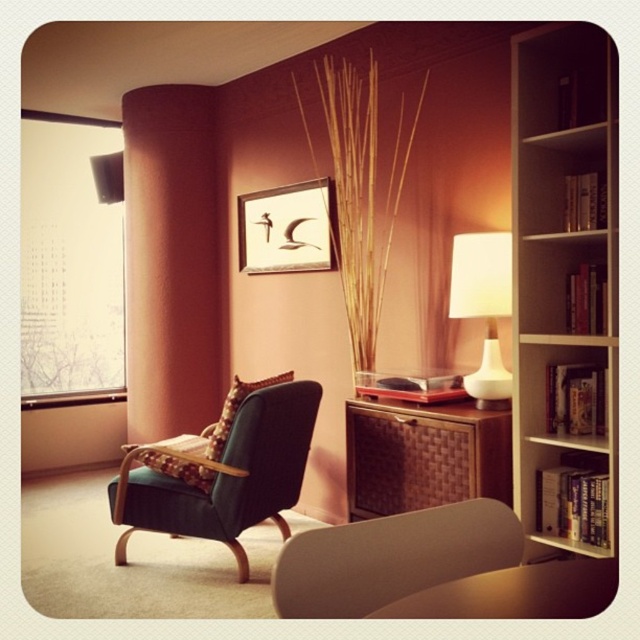
You are organizing a small party and need to place a 1.2 meter long tablecloth on one of the objects in the scene. Which object between the woven brown cabinet at center and the white glossy lamp at right can accommodate the tablecloth based on their widths?

The woven brown cabinet at center has a larger width than the white glossy lamp at right, so it can accommodate the 1.2 meter long tablecloth.

You are standing in the living room and see two points marked in the image. Which point is closer to you, point [419,429] or point [458,272]?

Point [419,429] is further to the camera than point [458,272], so the closer point to you is point [458,272].

From the picture: You are sitting in the matte teal armchair at center and want to look out through the transparent glass window at left. In which direction should you turn your head?

You should turn your head to the left because the transparent glass window at left is located to the left of the matte teal armchair at center.